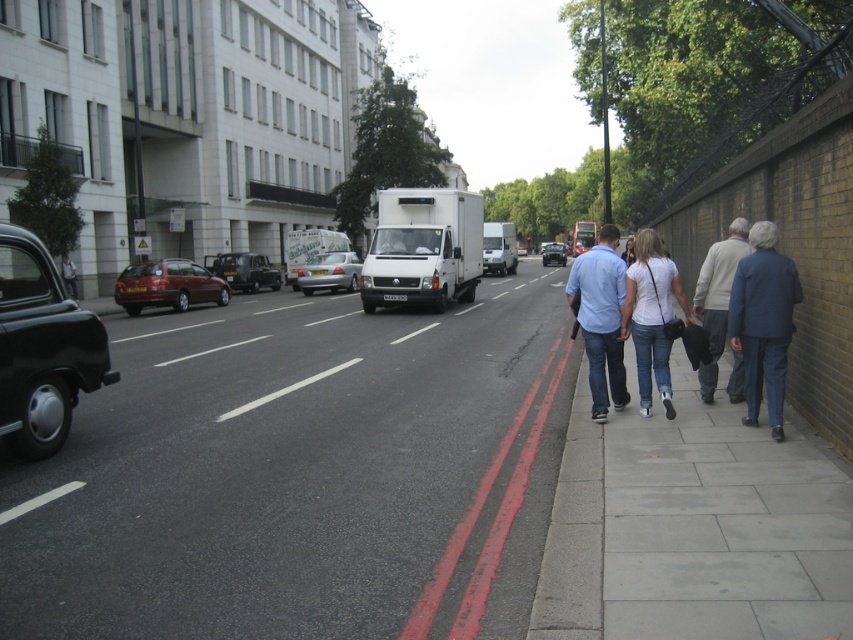
Is point (711, 365) closer to viewer compared to point (270, 282)?

Yes, it is in front of point (270, 282).

The height and width of the screenshot is (640, 853). What do you see at coordinates (651, 316) in the screenshot?
I see `denim jeans at sidewalk center` at bounding box center [651, 316].

Between point (675, 282) and point (251, 269), which one is positioned behind?

Point (251, 269)

I want to click on denim jeans at sidewalk center, so click(x=651, y=316).

Can you confirm if smooth concrete sidewalk at lower right is taller than matte red station wagon at center-left?

No.

Is point (230, 625) behind point (142, 276)?

No, (230, 625) is in front of (142, 276).

At what (x,y) coordinates should I click in order to perform the action: click on smooth concrete sidewalk at lower right. Please return your answer as a coordinate pair (x, y). This screenshot has width=853, height=640. Looking at the image, I should click on (271, 467).

Locate an element on the screen. The width and height of the screenshot is (853, 640). smooth concrete sidewalk at lower right is located at coordinates (271, 467).

Can you confirm if metallic silver suv at center-left is positioned above matte black van at center?

No, metallic silver suv at center-left is not above matte black van at center.

What are the coordinates of `metallic silver suv at center-left` in the screenshot? It's located at (244, 269).